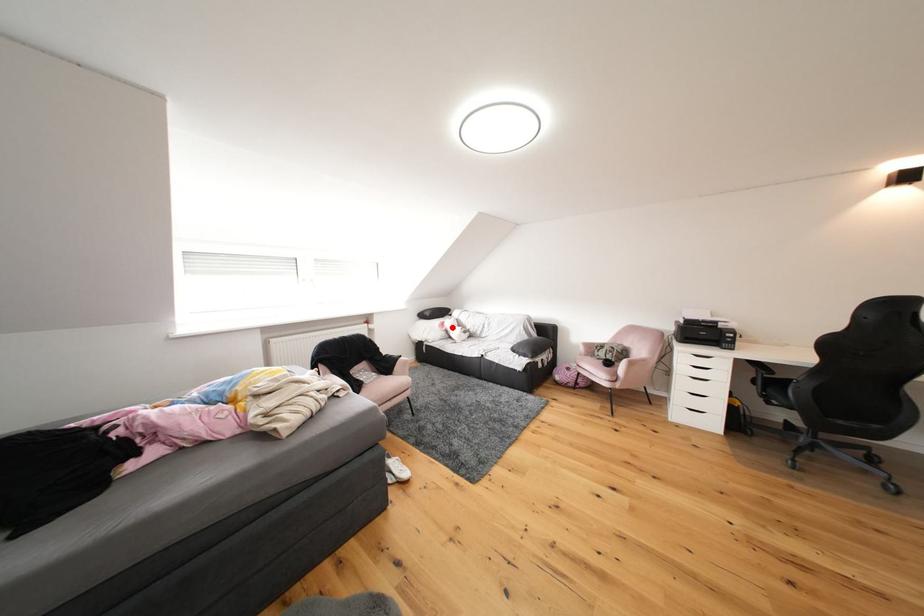
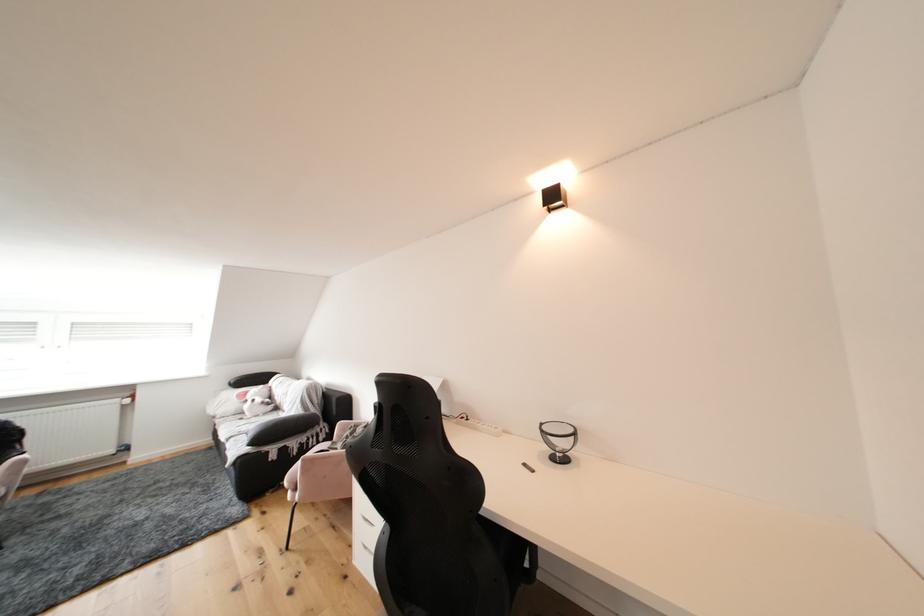
Question: I am providing you with two images of the same scene from different viewpoints. Image1 has a red point marked. In image2, the corresponding 3D location appears at what relative position? Reply with the corresponding letter.

Choices:
 (A) Closer
 (B) Farther

Answer: (B)